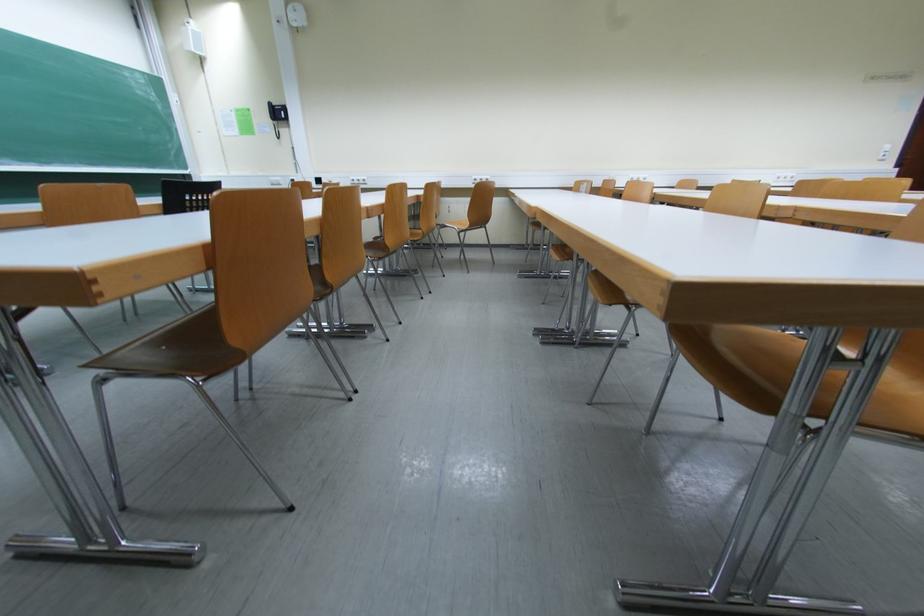
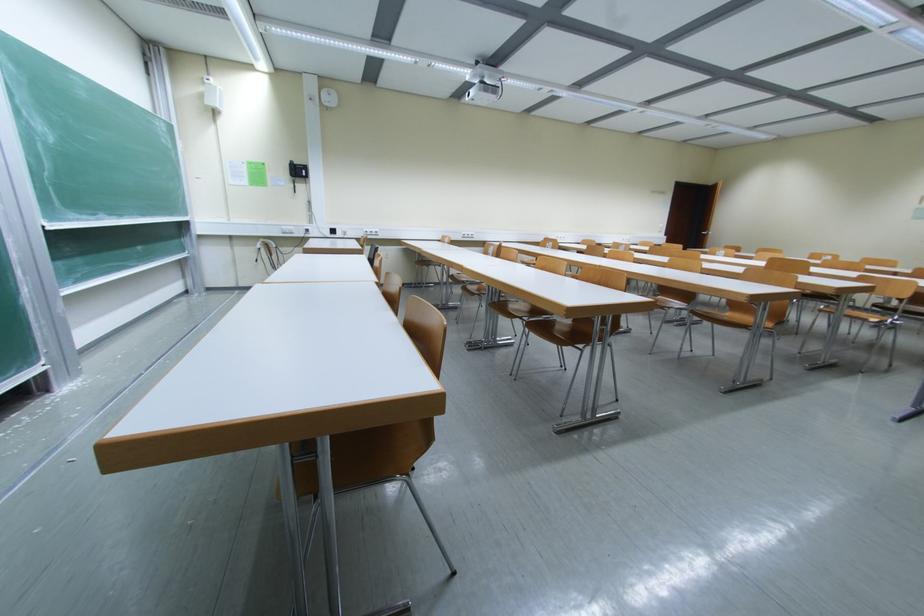
Question: In a continuous first-person perspective shot, in which direction is the camera moving?

Choices:
 (A) Left
 (B) Right
 (C) Forward
 (D) Backward

Answer: (A)